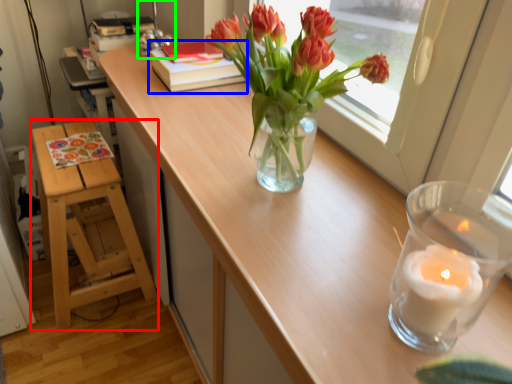
Question: Based on their relative distances, which object is nearer to furniture (highlighted by a red box)? Choose from book (highlighted by a blue box) and table lamp (highlighted by a green box).

Choices:
 (A) book
 (B) table lamp

Answer: (A)